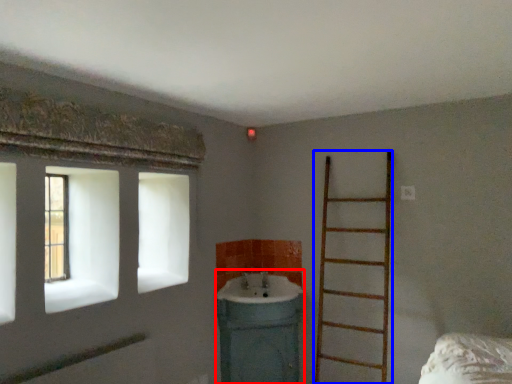
Question: Which point is further to the camera, sink (highlighted by a red box) or ladder (highlighted by a blue box)?

Choices:
 (A) sink
 (B) ladder

Answer: (A)